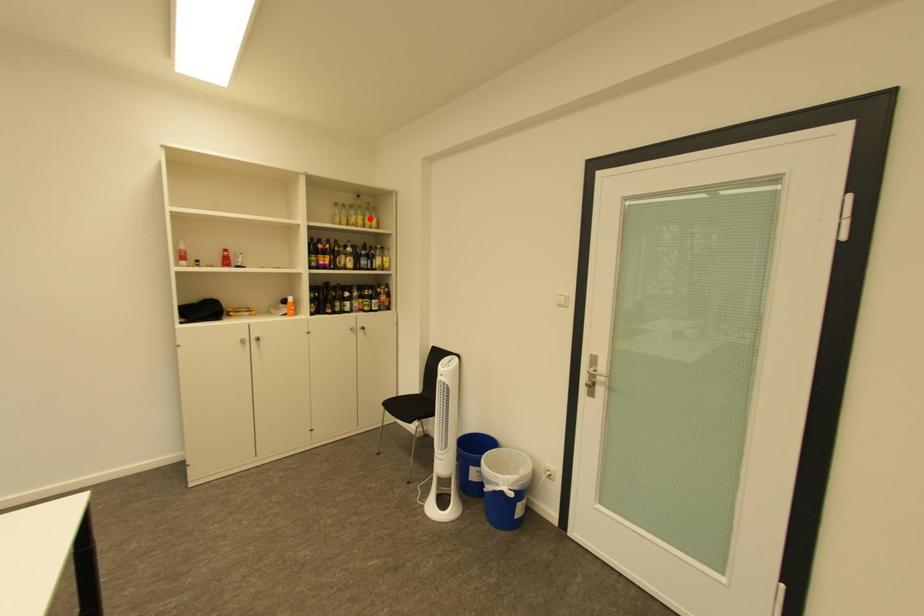
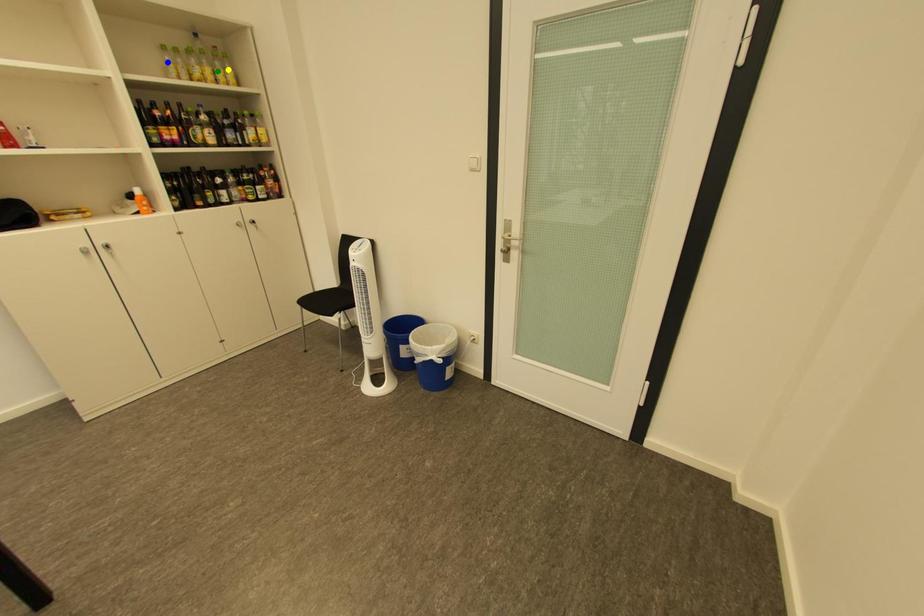
Question: I am providing you with two images of the same scene from different viewpoints. A red point is marked on the first image. You are given multiple points on the second image. Can you choose the point in image 2 that corresponds to the point in image 1?

Choices:
 (A) yellow point
 (B) green point
 (C) blue point

Answer: (B)